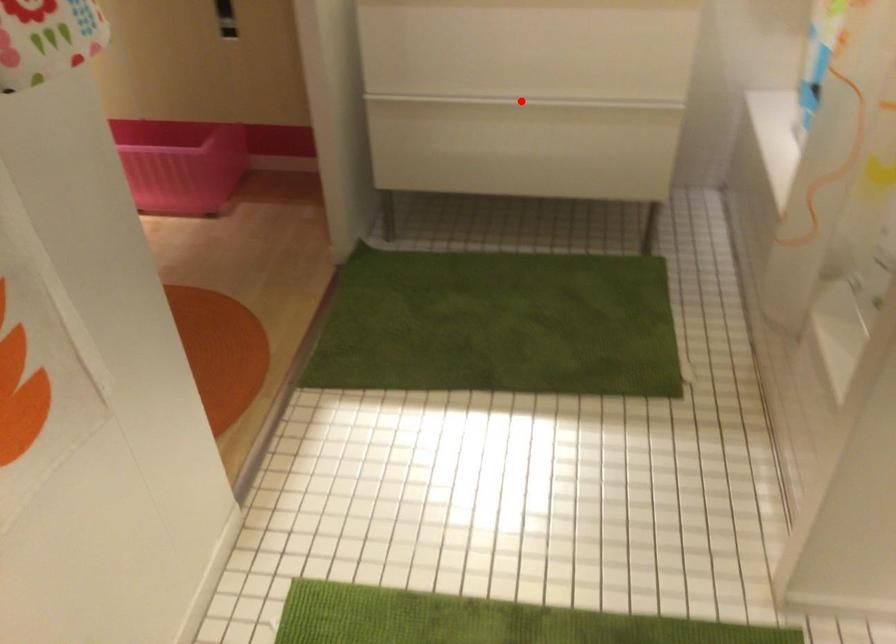
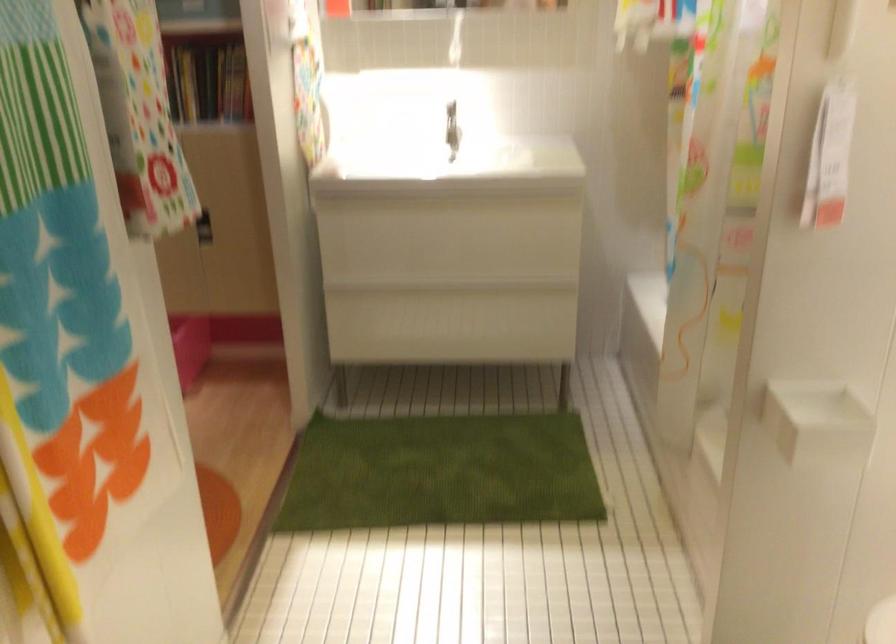
Find the pixel in the second image that matches the highlighted location in the first image.

(453, 288)